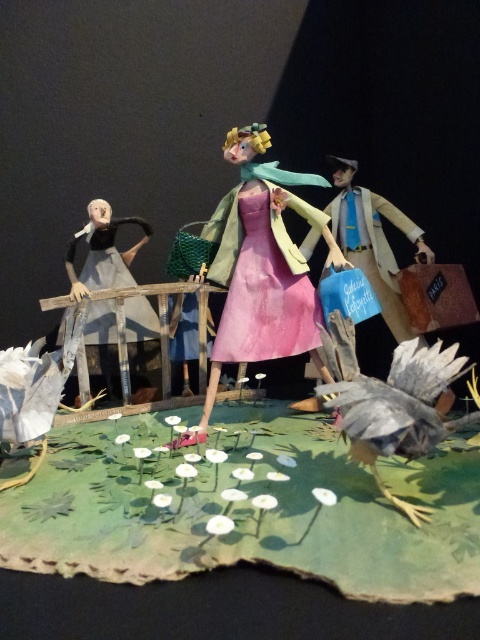
Does gray paper bird at lower right have a larger size compared to matte gray dress at left?

No.

Is gray paper bird at lower right shorter than matte gray dress at left?

Correct, gray paper bird at lower right is not as tall as matte gray dress at left.

Describe the element at coordinates (391, 401) in the screenshot. The width and height of the screenshot is (480, 640). I see `gray paper bird at lower right` at that location.

Where is `gray paper bird at lower right`? gray paper bird at lower right is located at coordinates (391, 401).

The image size is (480, 640). Describe the element at coordinates (263, 264) in the screenshot. I see `matte pink dress at center` at that location.

Where is `matte pink dress at center`? matte pink dress at center is located at coordinates pos(263,264).

Describe the element at coordinates (263, 264) in the screenshot. The image size is (480, 640). I see `matte pink dress at center` at that location.

Where is `matte pink dress at center`? matte pink dress at center is located at coordinates (263, 264).

How distant is matte pink dress at center from gray paper bird at lower right?

matte pink dress at center and gray paper bird at lower right are 18.06 inches apart.

Does point (229, 278) come behind point (402, 426)?

Yes.

At what (x,y) coordinates should I click in order to perform the action: click on matte pink dress at center. Please return your answer as a coordinate pair (x, y). Image resolution: width=480 pixels, height=640 pixels. Looking at the image, I should click on (263, 264).